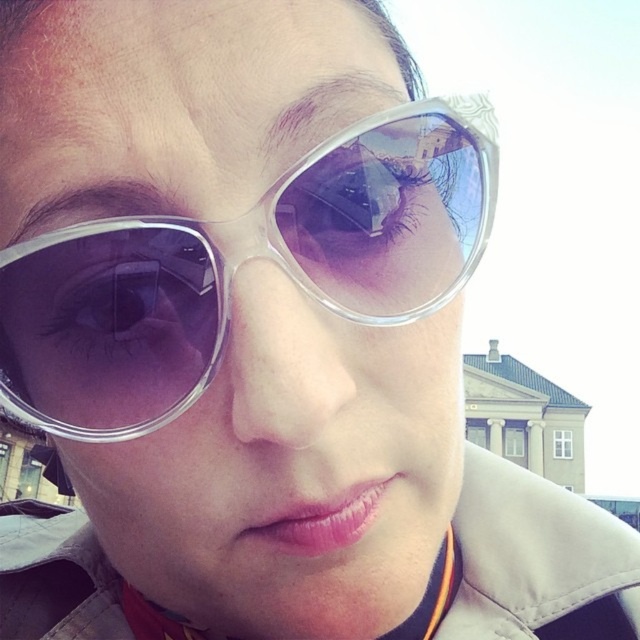
Is point (209, 284) closer to viewer compared to point (17, 620)?

That is True.

Can you confirm if transparent plastic sunglasses at center is thinner than light beige fabric trench coat at center?

Indeed, transparent plastic sunglasses at center has a lesser width compared to light beige fabric trench coat at center.

Measure the distance between point (35, 388) and camera.

Point (35, 388) is 69.03 meters from camera.

I want to click on transparent plastic sunglasses at center, so click(x=236, y=268).